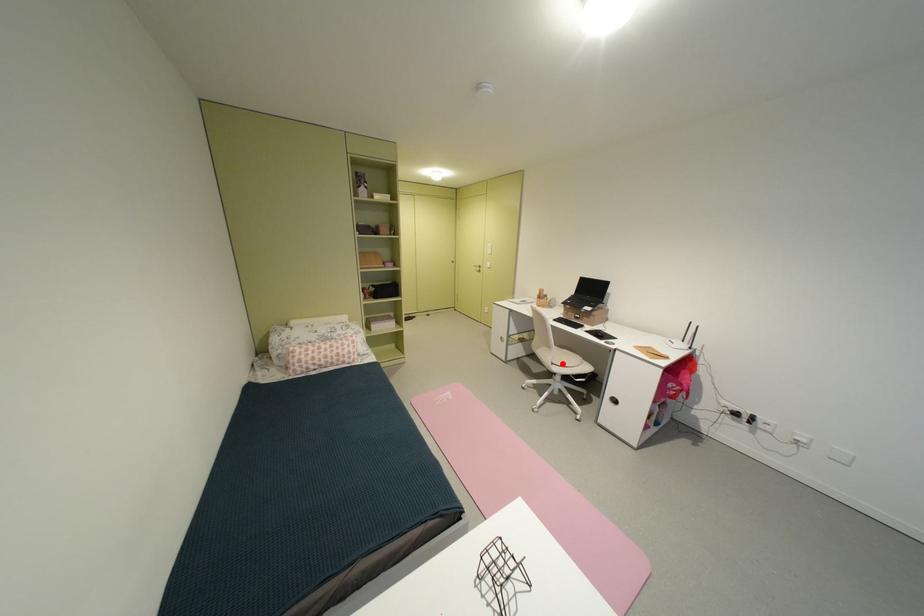
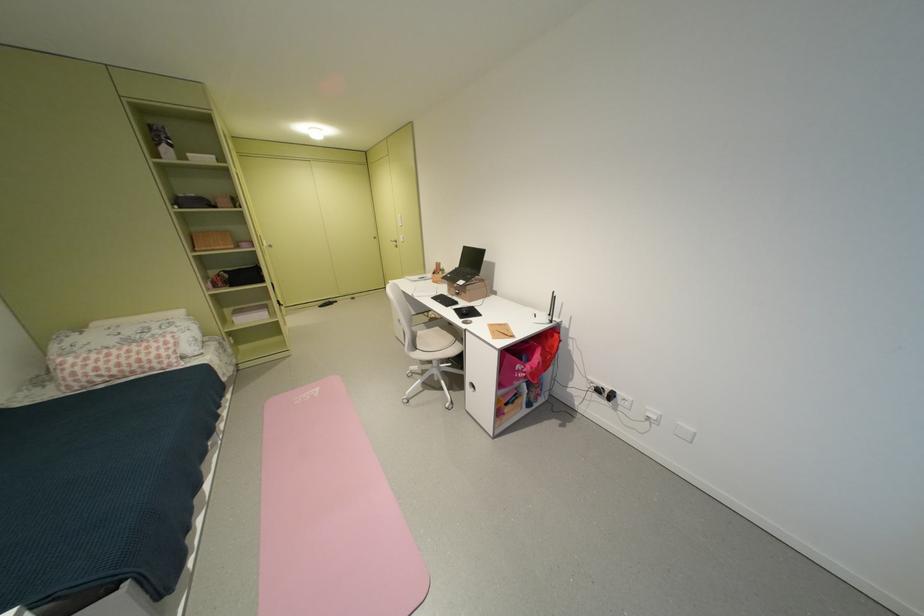
Find the pixel in the second image that matches the highlighted location in the first image.

(428, 349)